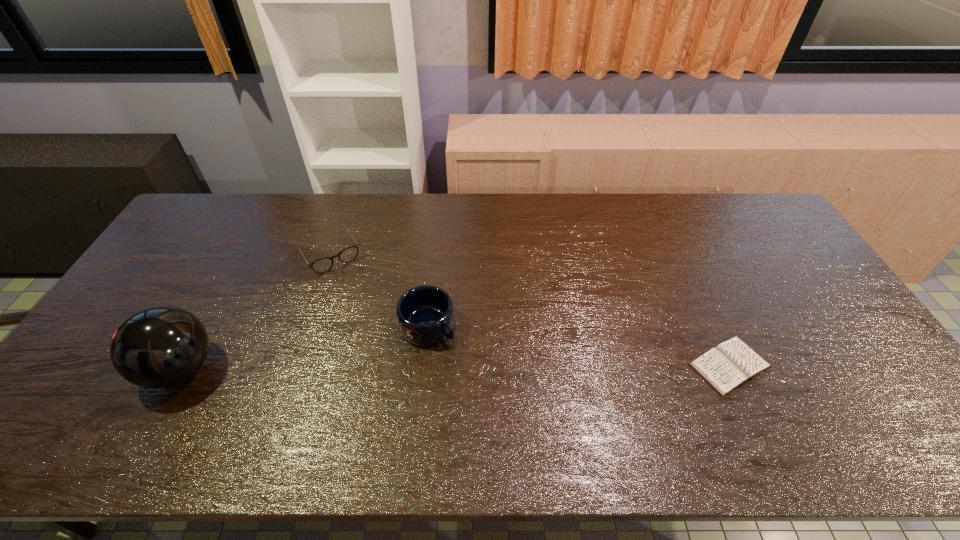
Find the location of `vacant area that lies between the second object from right to left and the bowling ball`. vacant area that lies between the second object from right to left and the bowling ball is located at coordinates (304, 347).

At what (x,y) coordinates should I click in order to perform the action: click on unoccupied position between the diary and the second shortest object. Please return your answer as a coordinate pair (x, y). The image size is (960, 540). Looking at the image, I should click on (529, 308).

Locate an element on the screen. The height and width of the screenshot is (540, 960). vacant space that is in between the bowling ball and the second tallest object is located at coordinates (304, 347).

Locate which object is the closest to the second object from left to right. Please provide its 2D coordinates. Your answer should be formatted as a tuple, i.e. [(x, y)], where the tuple contains the x and y coordinates of a point satisfying the conditions above.

[(425, 315)]

Where is `the third closest object relative to the mug`? Image resolution: width=960 pixels, height=540 pixels. the third closest object relative to the mug is located at coordinates (725, 367).

The image size is (960, 540). Identify the location of free location that satisfies the following two spatial constraints: 1. on the front side of the third shortest object; 2. on the right side of the third tallest object. (301, 326).